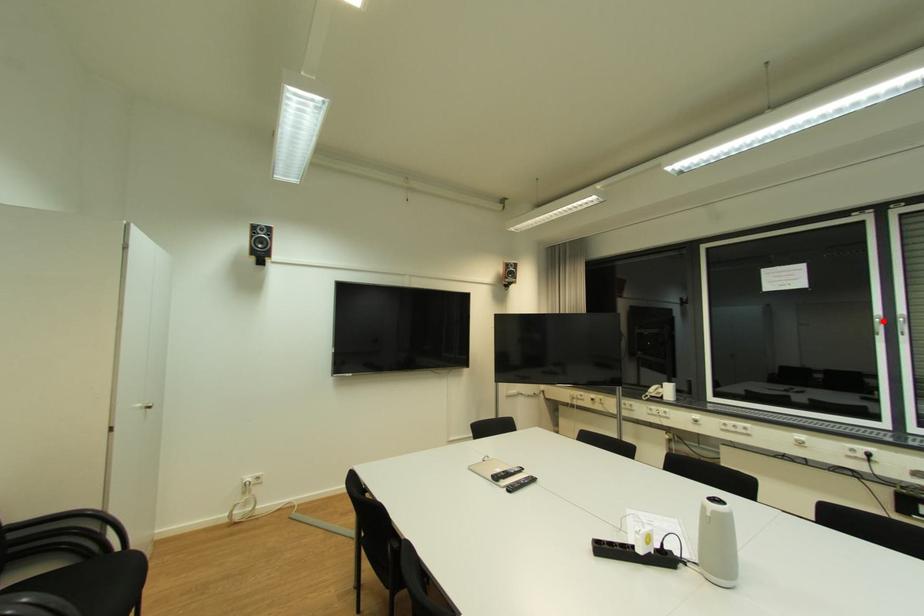
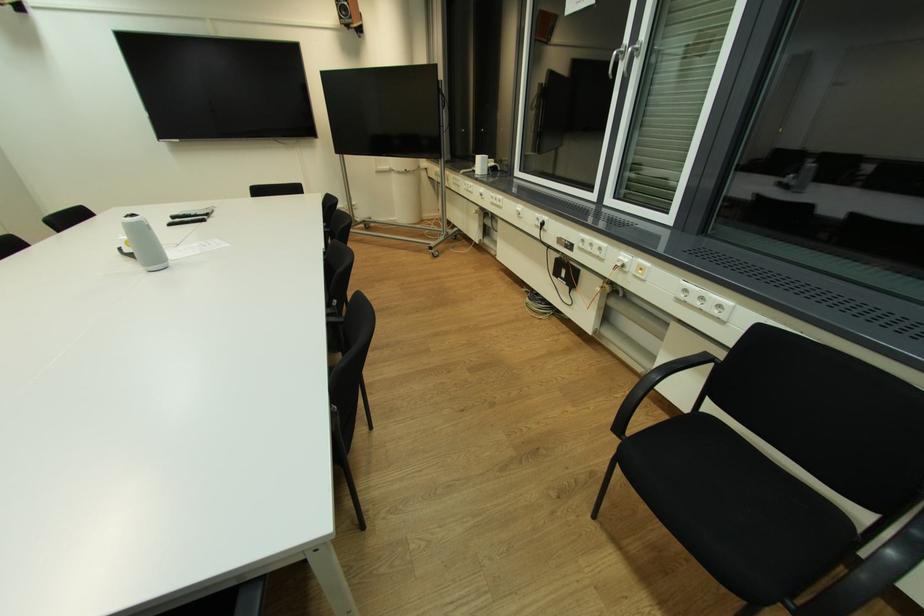
Question: I am providing you with two images of the same scene from different viewpoints. A red point is marked on the first image. Is the red point's position out of view in image 2?

Choices:
 (A) Yes
 (B) No

Answer: (B)